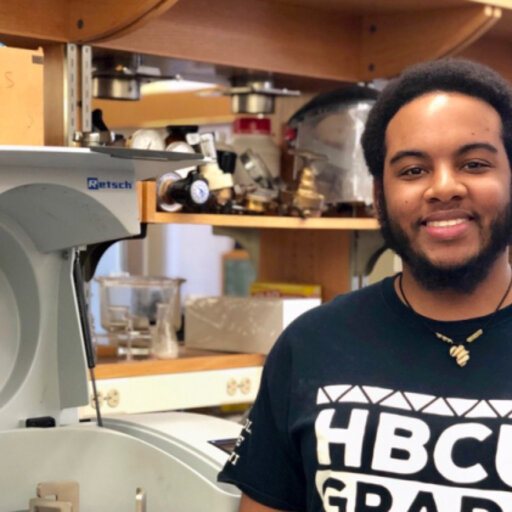
What are the coordinates of `top shelf clutter` in the screenshot? It's located at (320, 181), (238, 178), (169, 188).